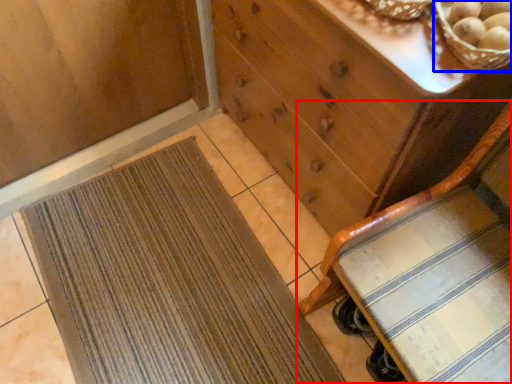
Question: Among these objects, which one is farthest to the camera, furniture (highlighted by a red box) or basket (highlighted by a blue box)?

Choices:
 (A) furniture
 (B) basket

Answer: (B)